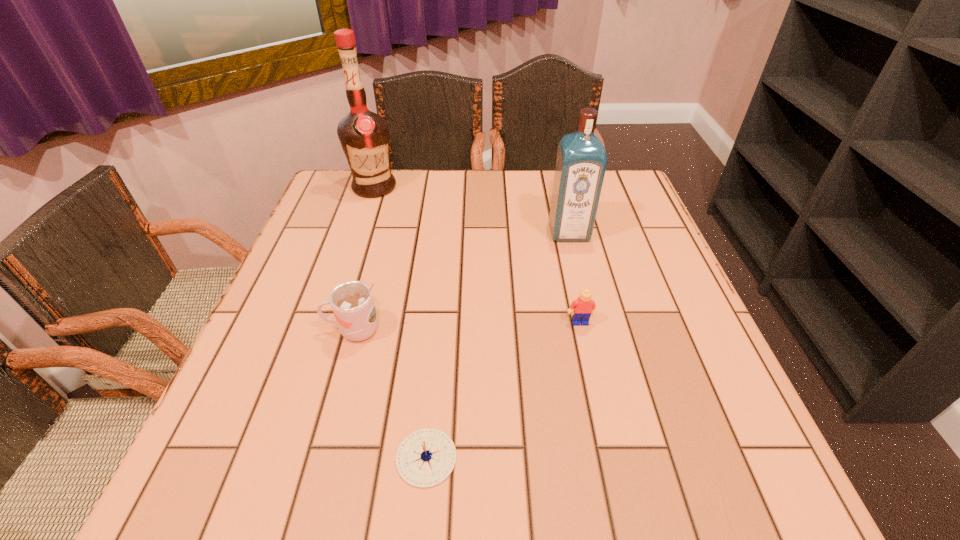
Locate an element on the screen. free point that satisfies the following two spatial constraints: 1. on the face of the Lego; 2. on the side with the handle of the cup is located at coordinates (582, 330).

You are a GUI agent. You are given a task and a screenshot of the screen. Output one action in this format:
    pyautogui.click(x=<x>, y=<y>)
    Task: Click on the vacant space that satisfies the following two spatial constraints: 1. on the front and back of the third object from left to right; 2. on the left side of the farther liquor
    The width and height of the screenshot is (960, 540).
    Given the screenshot: What is the action you would take?
    pyautogui.click(x=284, y=457)